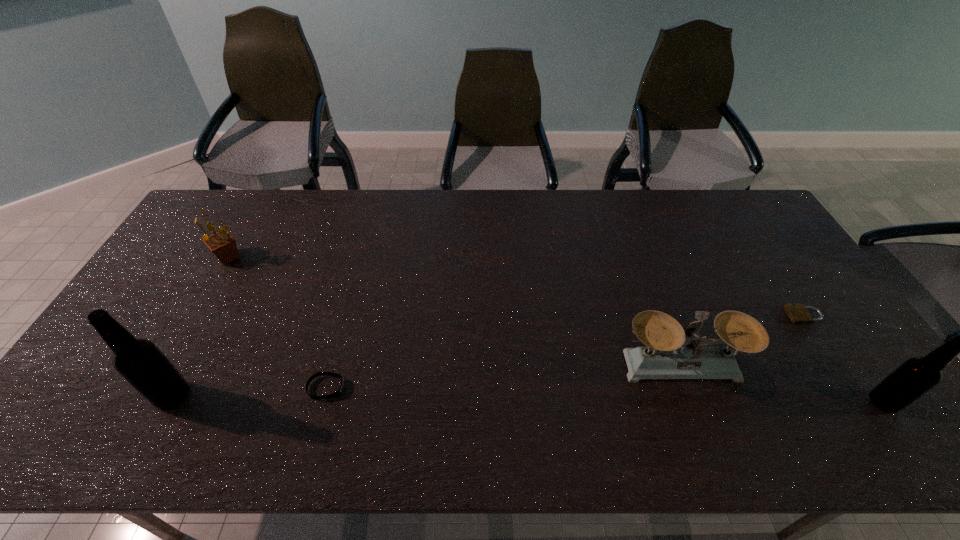
Where is `free space located at the front of the sunflower with flowers visible`? The height and width of the screenshot is (540, 960). free space located at the front of the sunflower with flowers visible is located at coordinates (208, 293).

Where is `blank area located 0.280m on the keyhole side of the fifth nearest object`? This screenshot has height=540, width=960. blank area located 0.280m on the keyhole side of the fifth nearest object is located at coordinates (688, 315).

Image resolution: width=960 pixels, height=540 pixels. Find the location of `blank space located on the keyhole side of the fifth nearest object`. blank space located on the keyhole side of the fifth nearest object is located at coordinates (753, 315).

What are the coordinates of `vacant space located on the keyhole side of the fifth nearest object` in the screenshot? It's located at (721, 315).

What are the coordinates of `vacant space located 0.300m on the display of the fourth object from right to left` in the screenshot? It's located at (467, 388).

Image resolution: width=960 pixels, height=540 pixels. I want to click on free space located 0.050m on the front-facing side of the scale, so click(x=696, y=404).

The width and height of the screenshot is (960, 540). Find the location of `wristband that is at the near edge`. wristband that is at the near edge is located at coordinates (339, 391).

Find the location of a particular element. scale that is at the near edge is located at coordinates (664, 357).

Where is `object that is positioned at the left edge`? The height and width of the screenshot is (540, 960). object that is positioned at the left edge is located at coordinates (222, 244).

Locate an element on the screen. The height and width of the screenshot is (540, 960). beer bottle that is at the right edge is located at coordinates (916, 376).